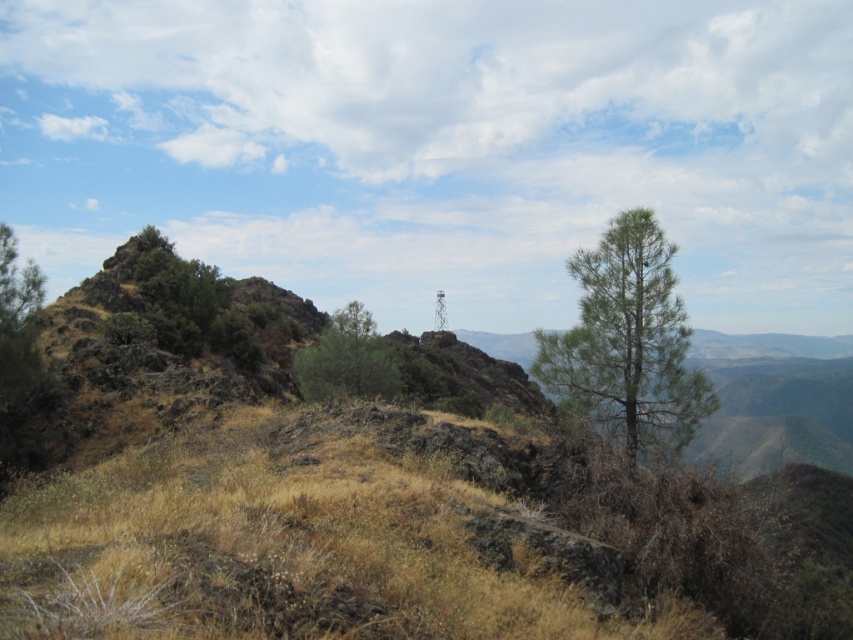
You are a hiker planning to take a photo of both the green matte tree at center and the green leafy tree at center. Which tree should you position yourself below to capture both in your shot?

You should position yourself below the green leafy tree at center because the green matte tree at center is located below it, allowing both to be in the frame when viewed from above the green leafy tree at center.

You are a hiker planning to set up a tent between the green rough rock at upper left and the green leafy tree at center. Which object is wider so you can choose the side with more space?

The green rough rock at upper left is wider than the green leafy tree at center, so setting up the tent on the side of the green rough rock at upper left would provide more space.

You are a hiker who wants to take a photo of the green leafy tree at center from the green rough rock at upper left. Given that your camera has a maximum focus range of 10 meters, will you be able to capture the tree clearly?

The green rough rock at upper left is 12.13 meters away from the green leafy tree at center. Since the camera can only focus up to 10 meters, you won